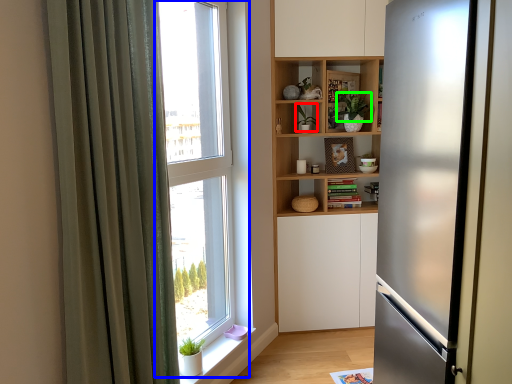
Question: Considering the real-world distances, which object is closest to plant (highlighted by a red box)? window (highlighted by a blue box) or plant (highlighted by a green box).

Choices:
 (A) window
 (B) plant

Answer: (B)